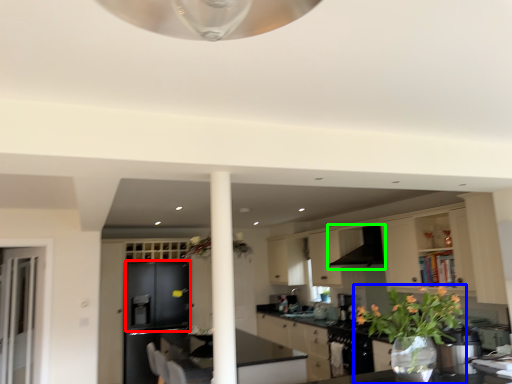
Question: Considering the real-world distances, which object is farthest from cabinetry (highlighted by a red box)? houseplant (highlighted by a blue box) or exhaust hood (highlighted by a green box)?

Choices:
 (A) houseplant
 (B) exhaust hood

Answer: (A)